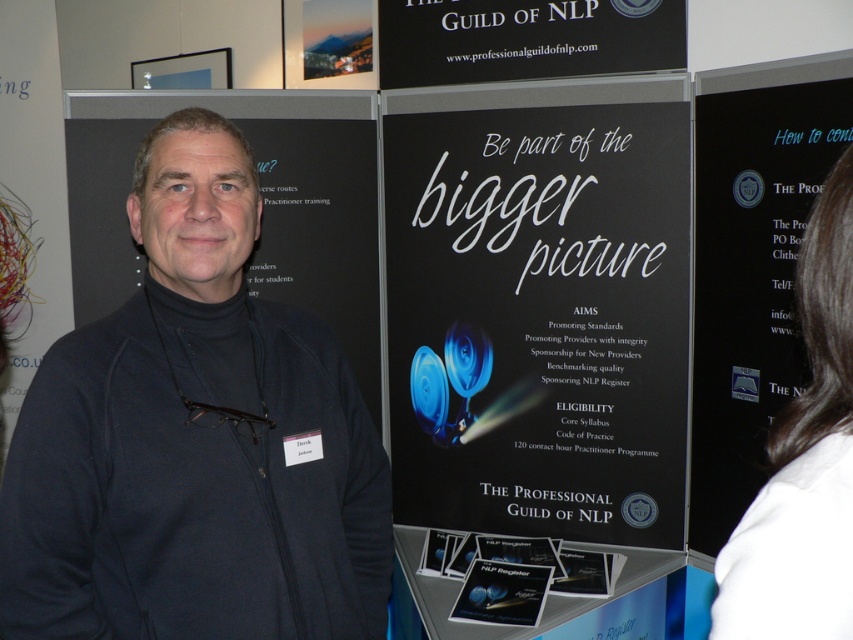
Does dark blue fleece at left have a smaller size compared to black paper poster at center?

Correct, dark blue fleece at left occupies less space than black paper poster at center.

Can you confirm if dark blue fleece at left is bigger than black paper poster at center?

Actually, dark blue fleece at left might be smaller than black paper poster at center.

The height and width of the screenshot is (640, 853). Find the location of `dark blue fleece at left`. dark blue fleece at left is located at coordinates (195, 440).

Does dark blue fleece at left have a lesser width compared to black matte sign at upper center?

Indeed, dark blue fleece at left has a lesser width compared to black matte sign at upper center.

Identify the location of dark blue fleece at left. The height and width of the screenshot is (640, 853). (195, 440).

Is dark blue fleece at left closer to camera compared to white fabric hair at upper right?

No, it is not.

Can you confirm if dark blue fleece at left is positioned below white fabric hair at upper right?

Yes, dark blue fleece at left is below white fabric hair at upper right.

Where is `dark blue fleece at left`? This screenshot has height=640, width=853. dark blue fleece at left is located at coordinates (195, 440).

The height and width of the screenshot is (640, 853). Find the location of `dark blue fleece at left`. dark blue fleece at left is located at coordinates (195, 440).